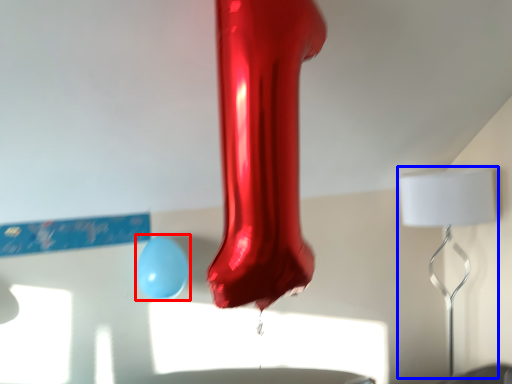
Question: Which object is further to the camera taking this photo, balloon (highlighted by a red box) or lamp (highlighted by a blue box)?

Choices:
 (A) balloon
 (B) lamp

Answer: (B)